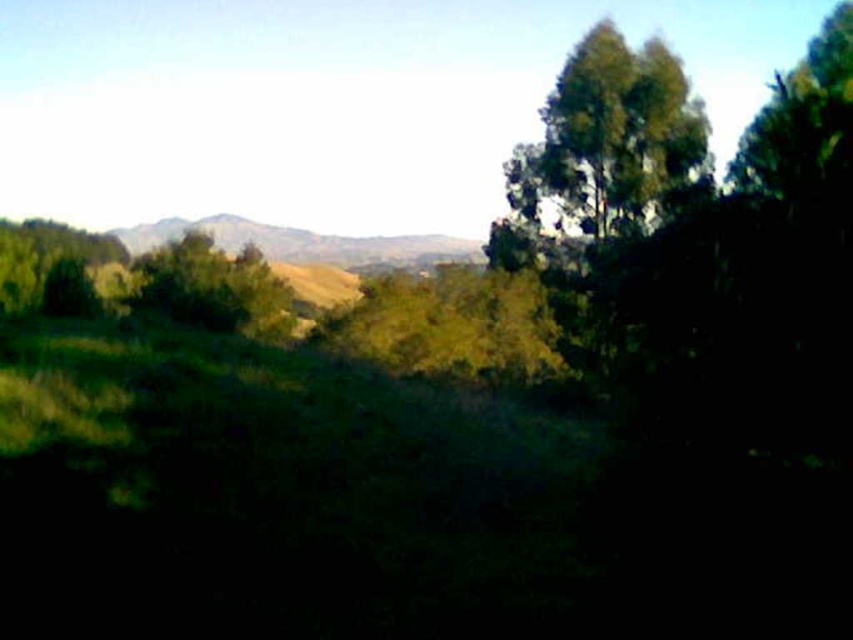
You are planning to plant a new tree in this landscape. The green leafy tree at upper right has a width of 2 meters. Can you fit it in the space between the rugged brown mountain at center and the dense cluster of trees in the foreground without overcrowding?

The green leafy tree at upper right is narrower than the rugged brown mountain at center, so it can be planted in the space between them without overcrowding since its width is smaller.

You are a hiker who wants to take a photo of the rugged brown mountain at center from the base of the green leafy tree at upper right. Can you estimate how far you need to walk to reach the mountain from the tree?

The distance between the green leafy tree at upper right and the rugged brown mountain at center is 36.18 meters, so you would need to walk approximately 36.18 meters to reach the mountain from the tree.